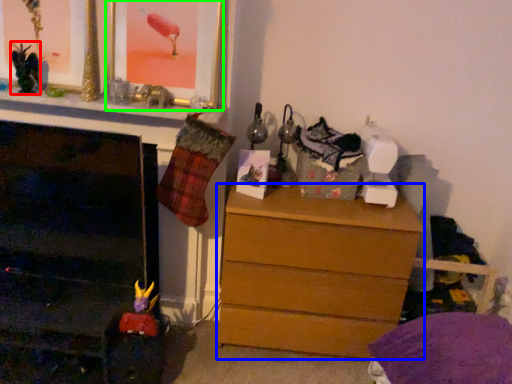
Question: Estimate the real-world distances between objects in this image. Which object is farther from toy (highlighted by a red box), chest of drawers (highlighted by a blue box) or picture frame (highlighted by a green box)?

Choices:
 (A) chest of drawers
 (B) picture frame

Answer: (A)